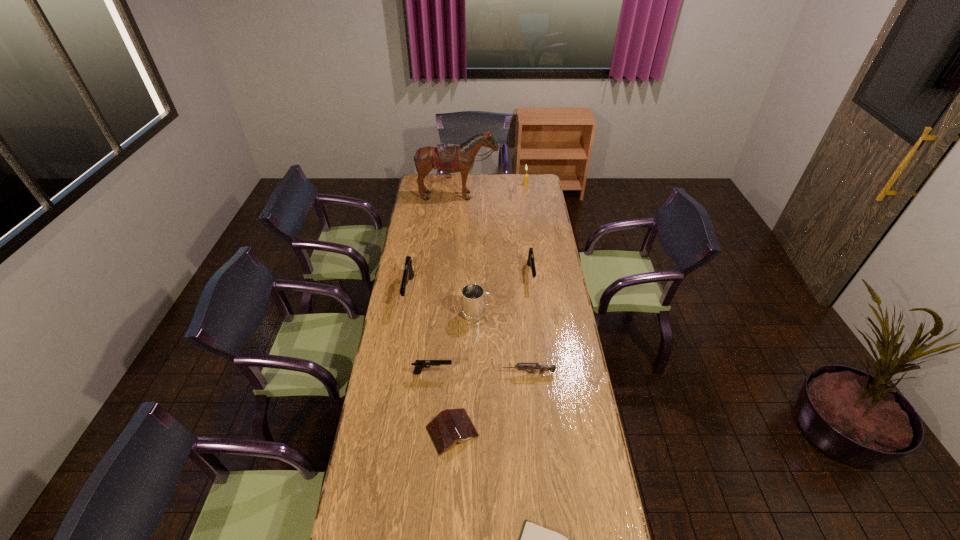
I want to click on the nearest black gun, so click(419, 364).

The width and height of the screenshot is (960, 540). In order to click on grey gun in this screenshot , I will do `click(542, 368)`.

This screenshot has width=960, height=540. Find the location of `the seventh tallest object`. the seventh tallest object is located at coordinates (542, 368).

This screenshot has width=960, height=540. I want to click on the eighth farthest object, so click(x=451, y=425).

Where is `the second shortest object`? This screenshot has width=960, height=540. the second shortest object is located at coordinates (451, 425).

Locate an element on the screen. The image size is (960, 540). vacant region located 0.190m on the back of the saddle is located at coordinates 456,220.

You are a GUI agent. You are given a task and a screenshot of the screen. Output one action in this format:
    pyautogui.click(x=<x>, y=<y>)
    Task: Click on the vacant space located on the front of the cream candle
    The width and height of the screenshot is (960, 540).
    Given the screenshot: What is the action you would take?
    pyautogui.click(x=531, y=221)

The height and width of the screenshot is (540, 960). In order to click on free spot located on the side of the mug with the handle in this screenshot , I will do `click(531, 313)`.

Identify the location of vacant space situated 0.300m at the aiming end of the leftmost black gun. (396, 365).

In order to click on vacant region located at the aiming end of the second biggest black gun in this screenshot , I will do `click(535, 305)`.